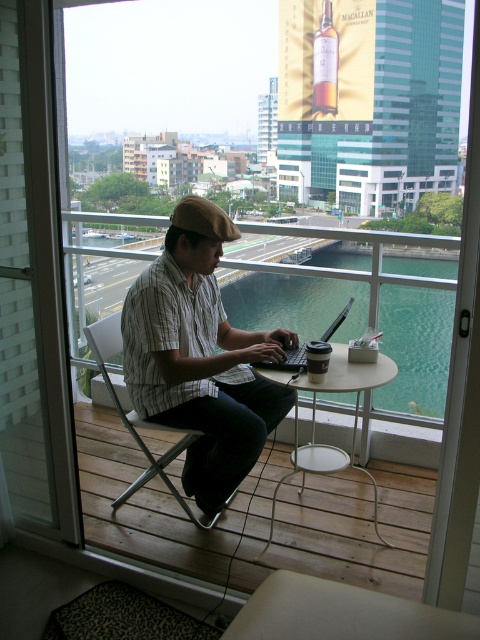
In the scene shown: You are designing a virtual tour of the balcony scene. To place a virtual arrow pointing to the striped cotton shirt at center, what coordinate should you use?

The striped cotton shirt at center is located at coordinate point (200,356), so the arrow should be placed at those coordinates.

You are standing on the balcony and want to reach a specific point marked at coordinates point (x=156, y=387). If you can only move forward in a straight line from your current position, will you be able to reach that point without any obstructions?

The distance of point (x=156, y=387) from viewer is 7.44 feet. Since there are no mentioned obstructions in the scene description, you can move forward in a straight line to reach the point.

You are a delivery person trying to place a small package on the white metal table at center and the black plastic laptop at center. Which surface can you use if you need a taller surface to avoid the package from being hidden by the laptop?

The white metal table at center is taller than the black plastic laptop at center, so you should place the package on the white metal table at center to avoid it being hidden by the laptop.